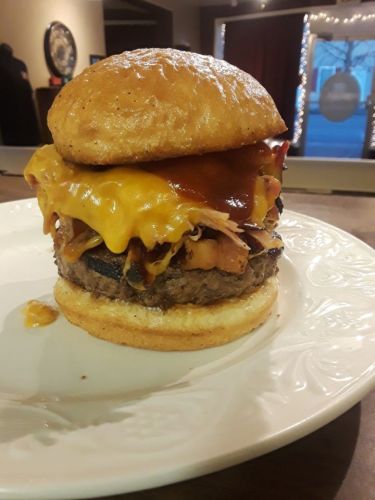
The width and height of the screenshot is (375, 500). In order to click on ceramic in this screenshot , I will do `click(134, 452)`.